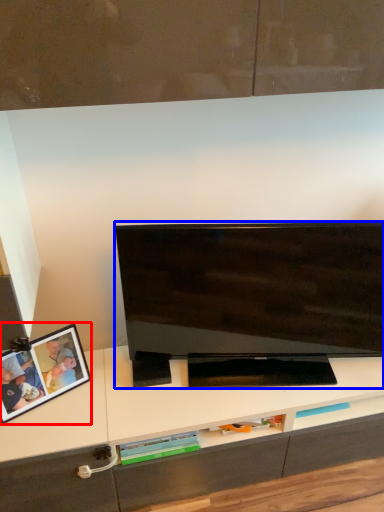
Question: Which object is further to the camera taking this photo, picture frame (highlighted by a red box) or television (highlighted by a blue box)?

Choices:
 (A) picture frame
 (B) television

Answer: (A)